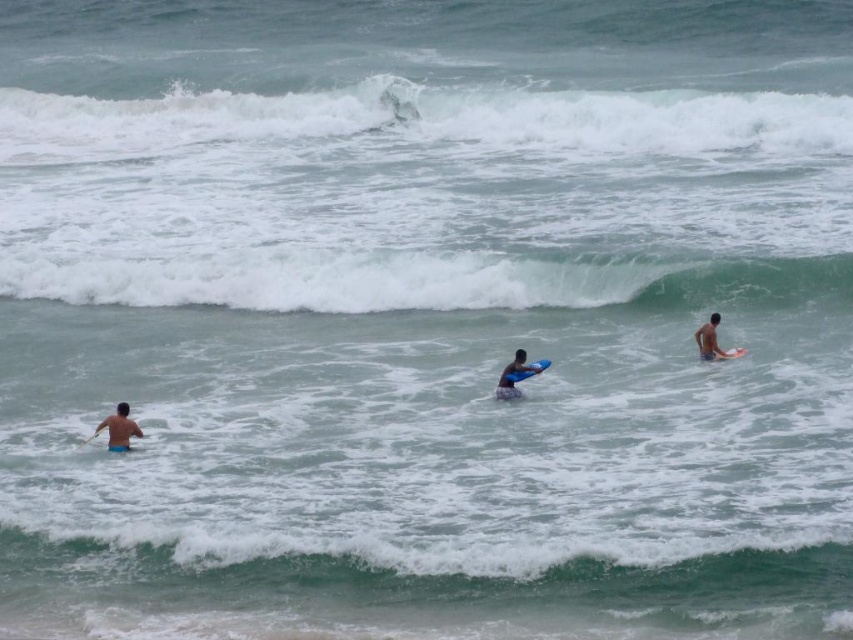
You are a surfer standing at the ocean edge and want to grab your surfboard. You see the blue matte surfboard at center and the blue foam surfboard at center. Which one is closer to you?

The blue matte surfboard at center is closer to you since it is only 4.91 inches away from the blue foam surfboard at center.

You are a photographer trying to capture a photo of the brown skin at upper right and the blue foam surfboard at center. Based on their positions, which one is located to the right of the other?

The brown skin at upper right is positioned on the right side of blue foam surfboard at center, so the brown skin at upper right is to the right of the blue foam surfboard at center.

You are standing at the point with coordinates point (546, 364) and want to move to the point with coordinates point (717, 348). Which direction should you move to reach your destination?

You should move backward to reach point (717, 348) because it is behind point (546, 364).